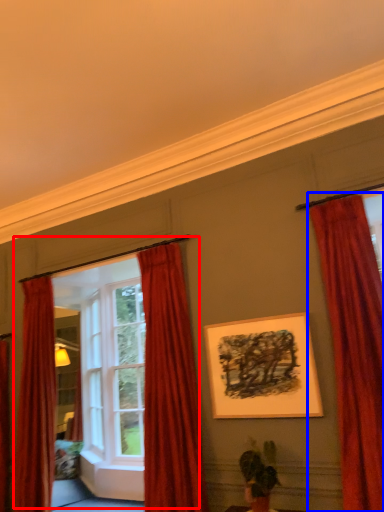
Question: Which of the following is the closest to the observer, window frame (highlighted by a red box) or curtain (highlighted by a blue box)?

Choices:
 (A) window frame
 (B) curtain

Answer: (B)